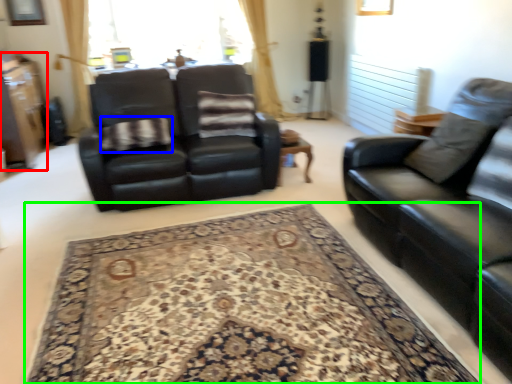
Question: Which is farther away from dresser (highlighted by a red box)? blanket (highlighted by a blue box) or mat (highlighted by a green box)?

Choices:
 (A) blanket
 (B) mat

Answer: (B)